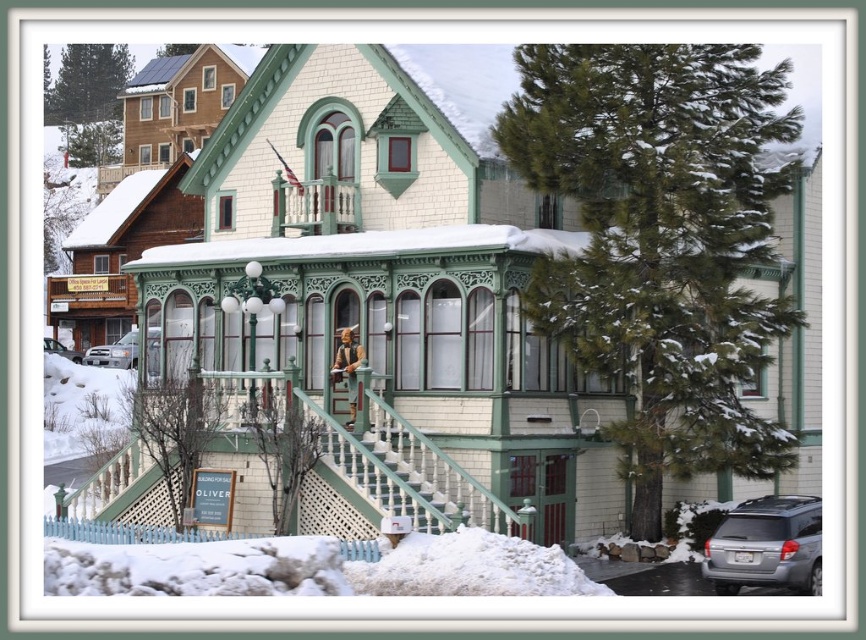
Question: Can you confirm if white painted wood stairs at center is thinner than silver metallic suv at lower left?

Choices:
 (A) no
 (B) yes

Answer: (A)

Question: Which of the following is the closest to the observer?

Choices:
 (A) (68, 349)
 (B) (793, 493)
 (C) (154, 330)
 (D) (401, 486)

Answer: (D)

Question: Which point is farther to the camera?

Choices:
 (A) silver metallic suv at lower right
 (B) silver metallic suv at lower left
 (C) silver metallic sedan at lower left

Answer: (B)

Question: Can you confirm if silver metallic suv at lower right is positioned above silver metallic sedan at lower left?

Choices:
 (A) no
 (B) yes

Answer: (A)

Question: Can you confirm if white painted wood stairs at center is positioned to the right of silver metallic suv at lower left?

Choices:
 (A) no
 (B) yes

Answer: (B)

Question: Which object appears farthest from the camera in this image?

Choices:
 (A) silver metallic sedan at lower left
 (B) white painted wood stairs at center

Answer: (A)